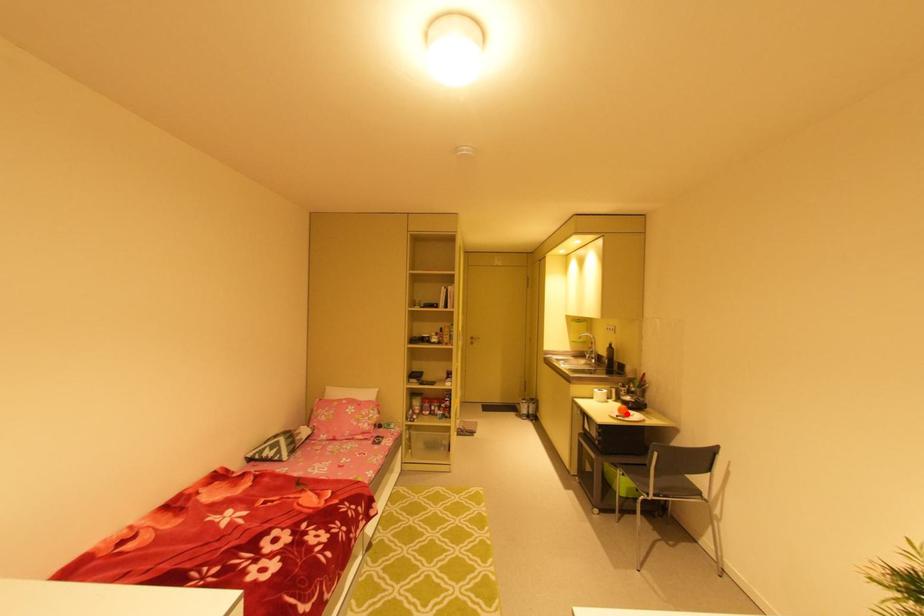
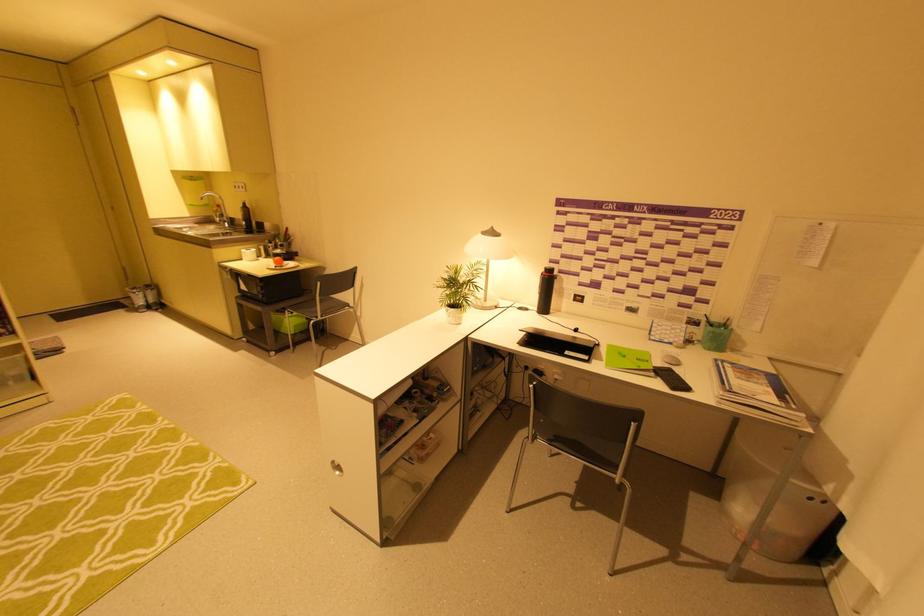
Where in the second image is the point corresponding to the highlighted location from the first image?

(283, 265)